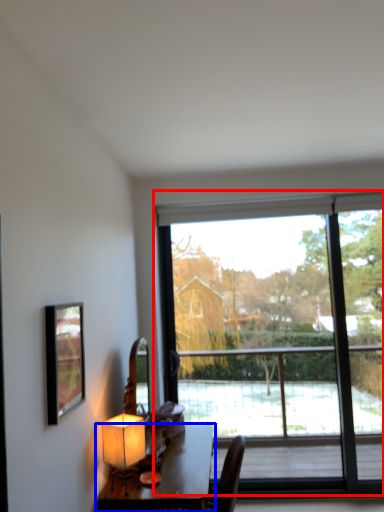
Question: Among these objects, which one is farthest to the camera, window (highlighted by a red box) or table (highlighted by a blue box)?

Choices:
 (A) window
 (B) table

Answer: (A)